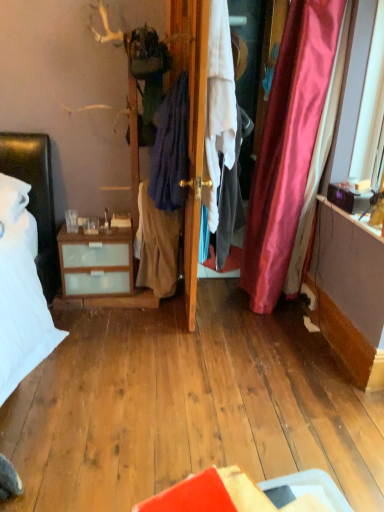
What is the approximate height of beige cotton skirt at center, positioned as the third clothing in right-to-left order?

beige cotton skirt at center, positioned as the third clothing in right-to-left order, is 20.11 inches in height.

This screenshot has height=512, width=384. Describe the element at coordinates (195, 132) in the screenshot. I see `white fabric screen door at center` at that location.

Identify the location of white cotton shirt at center, the first clothing when ordered from right to left. (226, 203).

In the image, is wooden door at center positioned in front of or behind white cotton shirt at center, the first clothing when ordered from right to left?

wooden door at center is positioned closer to the viewer than white cotton shirt at center, the first clothing when ordered from right to left.

Is wooden door at center not close to white cotton shirt at center, the first clothing when ordered from right to left?

No, wooden door at center is in close proximity to white cotton shirt at center, the first clothing when ordered from right to left.

Considering the relative sizes of wooden door at center and white cotton shirt at center, the first clothing when ordered from right to left, in the image provided, is wooden door at center taller than white cotton shirt at center, the first clothing when ordered from right to left,?

Correct, wooden door at center is much taller as white cotton shirt at center, the first clothing when ordered from right to left.

Does point (208, 23) appear closer or farther from the camera than point (228, 200)?

Clearly, point (208, 23) is closer to the camera than point (228, 200).

Looking at the image, does white fabric screen door at center seem bigger or smaller compared to dark blue fabric at center, which ranks as the 2th clothing in left-to-right order?

In the image, white fabric screen door at center appears to be larger than dark blue fabric at center, which ranks as the 2th clothing in left-to-right order.

Can you tell me how much white fabric screen door at center and dark blue fabric at center, the second clothing in the right-to-left sequence, differ in facing direction?

They differ by 0.000724 degrees in their facing directions.

Which is behind, point (203, 191) or point (173, 109)?

The point (203, 191) is farther.

Are wooden door at center and white fabric screen door at center beside each other?

Yes, the surface of wooden door at center is in contact with white fabric screen door at center.

Measure the distance between wooden door at center and white fabric screen door at center.

They are 0.77 inches apart.

From a real-world perspective, is wooden door at center over white fabric screen door at center?

Yes.

Looking at the image, does wooden door at center seem bigger or smaller compared to white fabric screen door at center?

Clearly, wooden door at center is smaller in size than white fabric screen door at center.

Between white cotton shirt at center, the first clothing when ordered from right to left, and beige cotton skirt at center, positioned as the third clothing in right-to-left order, which one has smaller size?

beige cotton skirt at center, positioned as the third clothing in right-to-left order.

Consider the image. From a real-world perspective, is white cotton shirt at center, which is the third clothing in left-to-right order, physically below beige cotton skirt at center, positioned as the third clothing in right-to-left order?

Actually, white cotton shirt at center, which is the third clothing in left-to-right order, is physically above beige cotton skirt at center, positioned as the third clothing in right-to-left order, in the real world.

Is white cotton shirt at center, which is the third clothing in left-to-right order, positioned far away from beige cotton skirt at center, positioned as the third clothing in right-to-left order?

They are positioned close to each other.

Is white cotton shirt at center, the first clothing when ordered from right to left, looking in the opposite direction of white fabric screen door at center?

Absolutely, white cotton shirt at center, the first clothing when ordered from right to left, is directed away from white fabric screen door at center.

Does white cotton shirt at center, the first clothing when ordered from right to left, have a smaller size compared to white fabric screen door at center?

Actually, white cotton shirt at center, the first clothing when ordered from right to left, might be larger than white fabric screen door at center.

Based on their positions, is white cotton shirt at center, which is the third clothing in left-to-right order, located to the left or right of white fabric screen door at center?

white cotton shirt at center, which is the third clothing in left-to-right order, is to the left of white fabric screen door at center.

Does point (219, 164) appear closer or farther from the camera than point (203, 97)?

Clearly, point (219, 164) is more distant from the camera than point (203, 97).

Is dark blue fabric at center, which ranks as the 2th clothing in left-to-right order, behind beige cotton skirt at center, which is the first clothing in left-to-right order?

No, dark blue fabric at center, which ranks as the 2th clothing in left-to-right order, is closer to the viewer.

How different are the orientations of dark blue fabric at center, which ranks as the 2th clothing in left-to-right order, and beige cotton skirt at center, which is the first clothing in left-to-right order, in degrees?

There is a 0.000307-degree angle between the facing directions of dark blue fabric at center, which ranks as the 2th clothing in left-to-right order, and beige cotton skirt at center, which is the first clothing in left-to-right order.

From a real-world perspective, starting from the dark blue fabric at center, which ranks as the 2th clothing in left-to-right order, which clothing is the 2nd one below it? Please provide its 2D coordinates.

[(157, 246)]

Which object is closer to the camera, white cotton shirt at center, which is the third clothing in left-to-right order, or wooden door at center?

wooden door at center.

Which is less distant, (233, 208) or (193, 324)?

Clearly, point (233, 208) is more distant from the camera than point (193, 324).

Would you consider white cotton shirt at center, the first clothing when ordered from right to left, to be distant from wooden door at center?

No, white cotton shirt at center, the first clothing when ordered from right to left, is in close proximity to wooden door at center.

Is white cotton shirt at center, the first clothing when ordered from right to left, oriented away from wooden door at center?

No, wooden door at center is not at the back of white cotton shirt at center, the first clothing when ordered from right to left.

You are a GUI agent. You are given a task and a screenshot of the screen. Output one action in this format:
    pyautogui.click(x=<x>, y=<y>)
    Task: Click on the 1st clothing positioned below the wooden door at center (from a real-world perspective)
    This screenshot has height=512, width=384.
    Given the screenshot: What is the action you would take?
    pyautogui.click(x=226, y=203)

The height and width of the screenshot is (512, 384). Identify the location of clothing above the white fabric screen door at center (from a real-world perspective). (171, 148).

Based on their spatial positions, is white cotton shirt at center, which is the third clothing in left-to-right order, or beige cotton skirt at center, positioned as the third clothing in right-to-left order, further from white fabric screen door at center?

beige cotton skirt at center, positioned as the third clothing in right-to-left order.

From the image, which object appears to be farther from dark blue fabric at center, which ranks as the 2th clothing in left-to-right order, white fabric screen door at center or wooden door at center?

wooden door at center is further to dark blue fabric at center, which ranks as the 2th clothing in left-to-right order.

Consider the image. From the image, which object appears to be nearer to white cotton shirt at center, the first clothing when ordered from right to left, white fabric screen door at center or wooden door at center?

white fabric screen door at center.

When comparing their distances from white fabric screen door at center, does dark blue fabric at center, the second clothing in the right-to-left sequence, or white cotton shirt at center, the first clothing when ordered from right to left, seem closer?

dark blue fabric at center, the second clothing in the right-to-left sequence.

When comparing their distances from white fabric screen door at center, does white cotton shirt at center, the first clothing when ordered from right to left, or wooden door at center seem closer?

Among the two, wooden door at center is located nearer to white fabric screen door at center.

Estimate the real-world distances between objects in this image. Which object is closer to wooden door at center, beige cotton skirt at center, which is the first clothing in left-to-right order, or white fabric screen door at center?

The object closer to wooden door at center is white fabric screen door at center.

When comparing their distances from dark blue fabric at center, the second clothing in the right-to-left sequence, does white cotton shirt at center, which is the third clothing in left-to-right order, or beige cotton skirt at center, positioned as the third clothing in right-to-left order, seem further?

white cotton shirt at center, which is the third clothing in left-to-right order, lies further to dark blue fabric at center, the second clothing in the right-to-left sequence, than the other object.

Estimate the real-world distances between objects in this image. Which object is closer to dark blue fabric at center, which ranks as the 2th clothing in left-to-right order, beige cotton skirt at center, positioned as the third clothing in right-to-left order, or wooden door at center?

wooden door at center is positioned closer to the anchor dark blue fabric at center, which ranks as the 2th clothing in left-to-right order.

I want to click on clothing between dark blue fabric at center, which ranks as the 2th clothing in left-to-right order, and beige cotton skirt at center, positioned as the third clothing in right-to-left order, in the vertical direction, so point(226,203).

At what (x,y) coordinates should I click in order to perform the action: click on clothing between wooden door at center and dark blue fabric at center, the second clothing in the right-to-left sequence, in the front-back direction. Please return your answer as a coordinate pair (x, y). The height and width of the screenshot is (512, 384). Looking at the image, I should click on (226, 203).